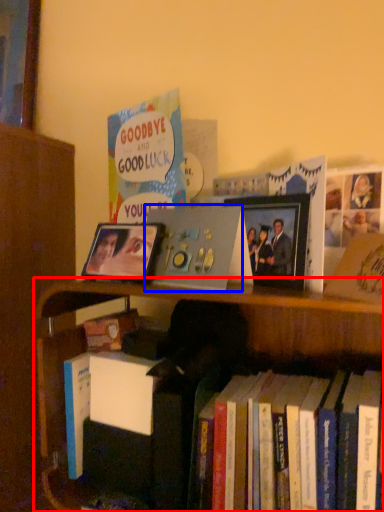
Question: Among these objects, which one is nearest to the camera, bookcase (highlighted by a red box) or paperback book (highlighted by a blue box)?

Choices:
 (A) bookcase
 (B) paperback book

Answer: (A)